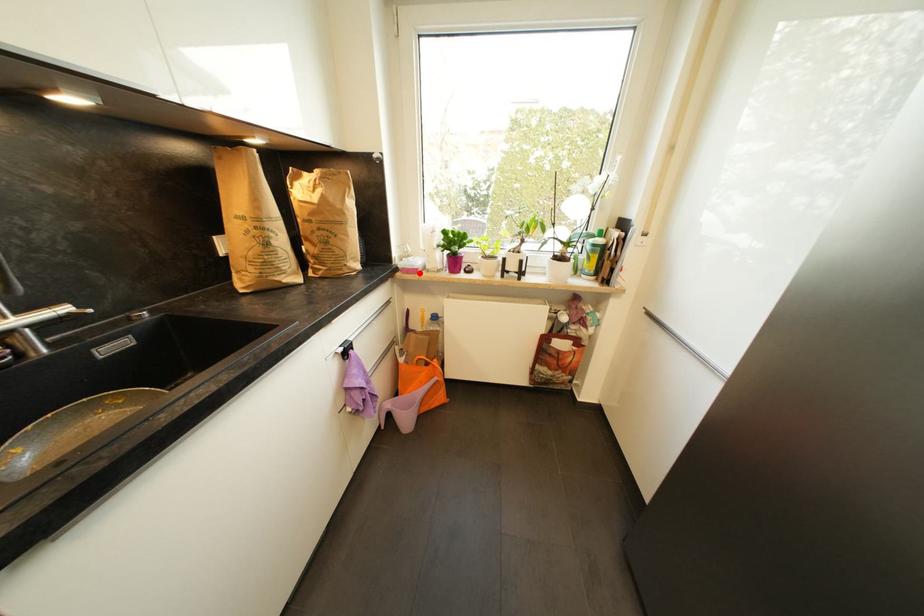
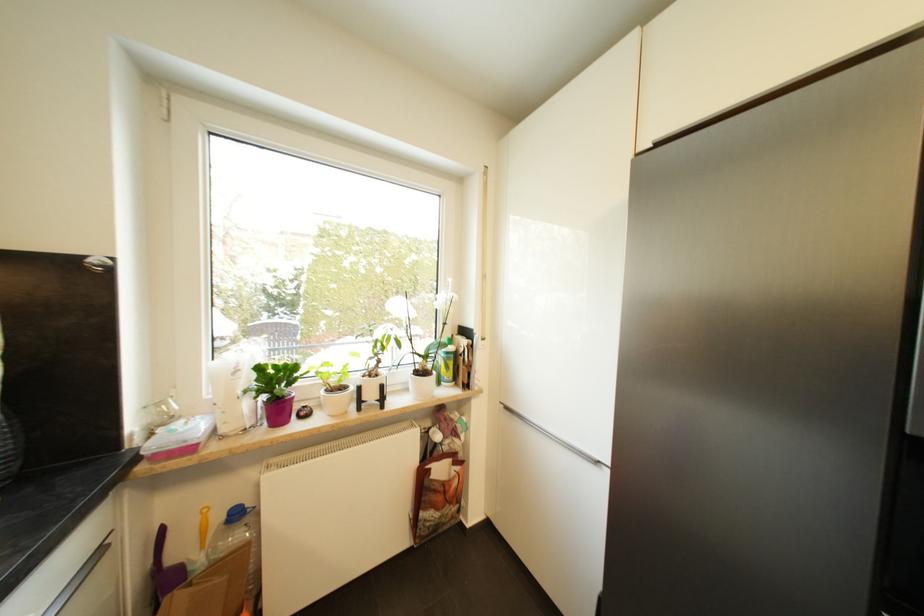
Question: I am providing you with two images of the same scene from different viewpoints. A red point is marked on the first image. Can you still see the location of the red point in image 2?

Choices:
 (A) Yes
 (B) No

Answer: (A)